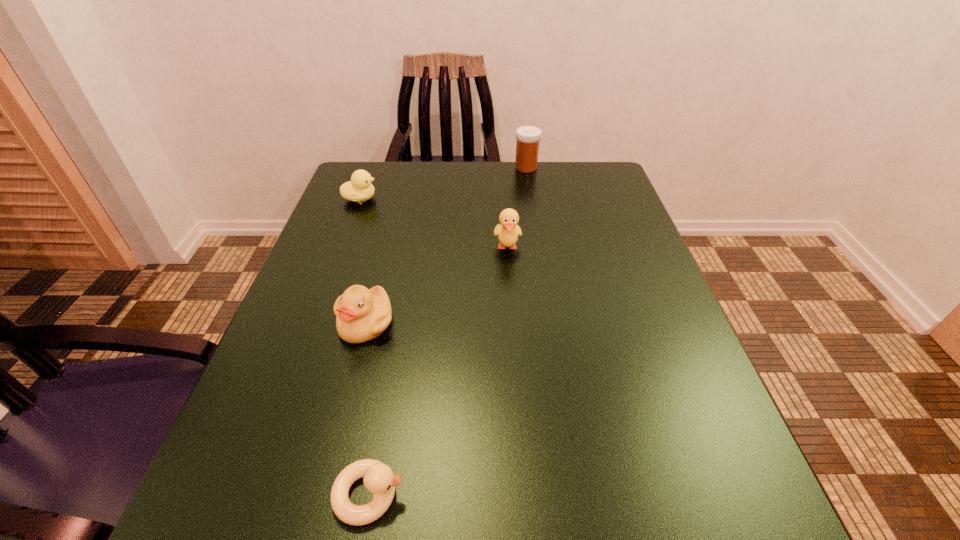
Identify the location of free space that is in between the second farthest duckling and the nearest duckling. (439, 370).

The height and width of the screenshot is (540, 960). I want to click on free space between the farthest duckling and the medicine, so click(x=443, y=183).

The height and width of the screenshot is (540, 960). I want to click on vacant area that lies between the second nearest duckling and the shortest duckling, so click(x=368, y=408).

At what (x,y) coordinates should I click in order to perform the action: click on free space that is in between the rightmost object and the second object from right to left. Please return your answer as a coordinate pair (x, y). Image resolution: width=960 pixels, height=540 pixels. Looking at the image, I should click on (516, 207).

I want to click on object that is the second closest one to the shortest duckling, so click(507, 231).

Locate an element on the screen. This screenshot has height=540, width=960. object that ranks as the second closest to the rightmost duckling is located at coordinates (527, 146).

Locate an element on the screen. the second closest duckling to the rightmost duckling is located at coordinates (359, 189).

Image resolution: width=960 pixels, height=540 pixels. Identify the location of the closest duckling relative to the nearest duckling. (362, 314).